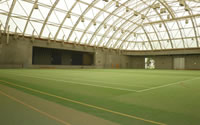
Where is `wall area below stage`? This screenshot has height=125, width=200. wall area below stage is located at coordinates (66, 67).